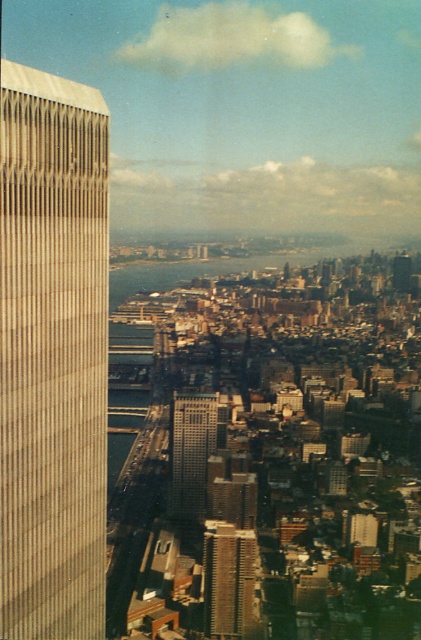
Question: Which of the following is the closest to the observer?

Choices:
 (A) (178, 449)
 (B) (37, 582)
 (C) (213, 524)

Answer: (B)

Question: Is beige textured building at left thinner than gray concrete building at center?

Choices:
 (A) no
 (B) yes

Answer: (A)

Question: Can you confirm if beige textured building at left is thinner than gray concrete building at center?

Choices:
 (A) yes
 (B) no

Answer: (B)

Question: Can you confirm if beige textured building at left is wider than silver glass skyscraper at center?

Choices:
 (A) no
 (B) yes

Answer: (B)

Question: Which of the following is the farthest from the observer?

Choices:
 (A) silver glass skyscraper at center
 (B) gray concrete building at center

Answer: (B)

Question: Which point is farther from the camera taking this photo?

Choices:
 (A) (26, 374)
 (B) (202, 406)

Answer: (B)